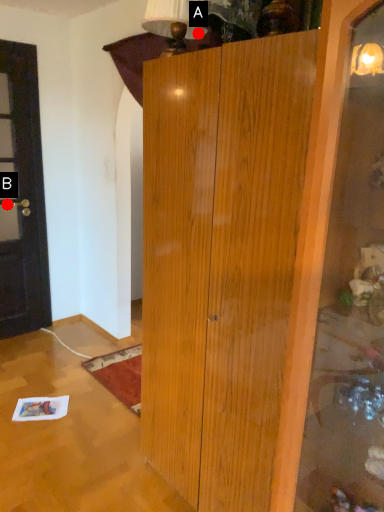
Question: Two points are circled on the image, labeled by A and B beside each circle. Which point is closer to the camera?

Choices:
 (A) A is closer
 (B) B is closer

Answer: (A)